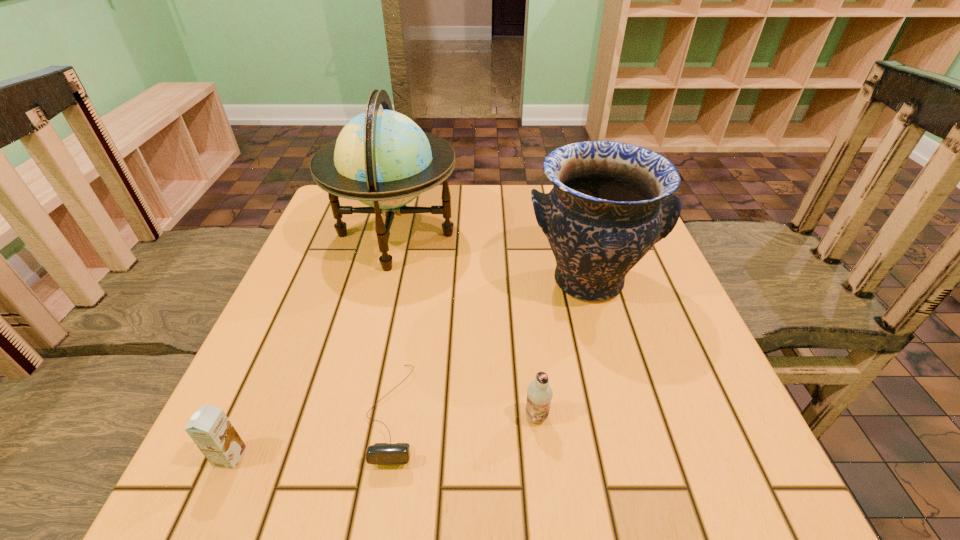
Where is `chocolate milk located at the near edge`? chocolate milk located at the near edge is located at coordinates (209, 427).

Where is `webcam located at the near edge`? The width and height of the screenshot is (960, 540). webcam located at the near edge is located at coordinates (380, 453).

At what (x,y) coordinates should I click in order to perform the action: click on globe that is at the left edge. Please return your answer as a coordinate pair (x, y). Looking at the image, I should click on (382, 158).

Locate an element on the screen. The height and width of the screenshot is (540, 960). chocolate milk situated at the left edge is located at coordinates (209, 427).

Identify the location of object that is at the right edge. (611, 202).

This screenshot has height=540, width=960. Find the location of `object located at the far left corner`. object located at the far left corner is located at coordinates pyautogui.click(x=382, y=158).

This screenshot has height=540, width=960. Find the location of `object at the near left corner`. object at the near left corner is located at coordinates (209, 427).

This screenshot has width=960, height=540. Identify the location of vacant region at the far edge of the desktop. (516, 193).

Where is `free space at the near edge of the desktop`? free space at the near edge of the desktop is located at coordinates (588, 452).

The height and width of the screenshot is (540, 960). Identify the location of blank space at the left edge of the desktop. (356, 302).